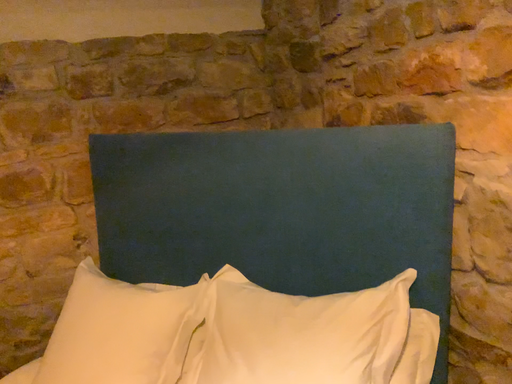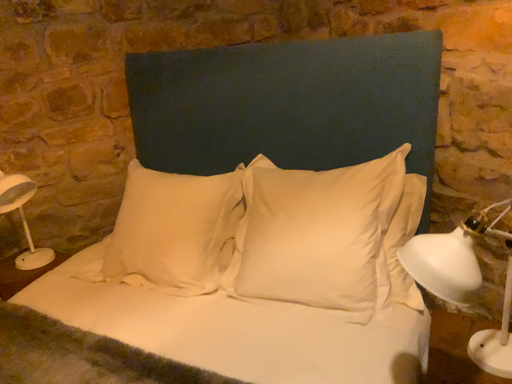
Question: How did the camera likely rotate when shooting the video?

Choices:
 (A) rotated upward
 (B) rotated downward

Answer: (B)